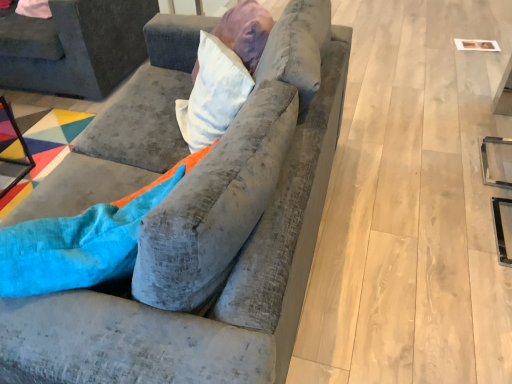
What do you see at coordinates (75, 46) in the screenshot? I see `velvet gray couch at upper left, marked as the second studio couch in a front-to-back arrangement` at bounding box center [75, 46].

At what (x,y) coordinates should I click in order to perform the action: click on velvet gray couch at upper left, marked as the second studio couch in a front-to-back arrangement. Please return your answer as a coordinate pair (x, y). The height and width of the screenshot is (384, 512). Looking at the image, I should click on (75, 46).

How much space does velvet gray couch at center, placed as the second studio couch when sorted from left to right, occupy vertically?

The height of velvet gray couch at center, placed as the second studio couch when sorted from left to right, is 34.11 inches.

The height and width of the screenshot is (384, 512). Find the location of `velvet gray couch at center, acting as the 1th studio couch starting from the front`. velvet gray couch at center, acting as the 1th studio couch starting from the front is located at coordinates (214, 250).

The height and width of the screenshot is (384, 512). What do you see at coordinates (214, 250) in the screenshot?
I see `velvet gray couch at center, acting as the 1th studio couch starting from the front` at bounding box center [214, 250].

Locate an element on the screen. The image size is (512, 384). velvet gray couch at upper left, the 1th studio couch from the back is located at coordinates (75, 46).

Is velvet gray couch at center, the 2th studio couch positioned from the back, to the right of velvet gray couch at upper left, marked as the second studio couch in a front-to-back arrangement, from the viewer's perspective?

Yes.

Is velvet gray couch at center, acting as the 1th studio couch starting from the front, positioned before velvet gray couch at upper left, marked as the second studio couch in a front-to-back arrangement?

That is True.

Which point is more distant from viewer, [309,195] or [83,19]?

The point [83,19] is more distant.

From the image's perspective, is velvet gray couch at center, placed as the second studio couch when sorted from left to right, positioned above or below velvet gray couch at upper left, the 1th studio couch from the back?

Clearly, from the image's perspective, velvet gray couch at center, placed as the second studio couch when sorted from left to right, is below velvet gray couch at upper left, the 1th studio couch from the back.

From a real-world perspective, which is physically above, velvet gray couch at center, the 2th studio couch positioned from the back, or velvet gray couch at upper left, marked as the second studio couch in a front-to-back arrangement?

velvet gray couch at center, the 2th studio couch positioned from the back.

Does velvet gray couch at center, the 2th studio couch positioned from the back, have a greater width compared to velvet gray couch at upper left, which ranks as the first studio couch in left-to-right order?

No, velvet gray couch at center, the 2th studio couch positioned from the back, is not wider than velvet gray couch at upper left, which ranks as the first studio couch in left-to-right order.

Is velvet gray couch at center, acting as the 1th studio couch starting from the front, taller than velvet gray couch at upper left, the 1th studio couch from the back?

Yes.

Is velvet gray couch at center, acting as the 1th studio couch starting from the front, smaller than velvet gray couch at upper left, marked as the second studio couch in a front-to-back arrangement?

No.

Is velvet gray couch at center, placed as the second studio couch when sorted from left to right, positioned beyond the bounds of velvet gray couch at upper left, marked as the 2th studio couch in a right-to-left arrangement?

velvet gray couch at center, placed as the second studio couch when sorted from left to right, lies outside velvet gray couch at upper left, marked as the 2th studio couch in a right-to-left arrangement,'s area.

Is there a large distance between velvet gray couch at center, which is counted as the first studio couch, starting from the right, and velvet gray couch at upper left, marked as the second studio couch in a front-to-back arrangement?

Indeed, velvet gray couch at center, which is counted as the first studio couch, starting from the right, is not near velvet gray couch at upper left, marked as the second studio couch in a front-to-back arrangement.

Is velvet gray couch at center, placed as the second studio couch when sorted from left to right, oriented towards velvet gray couch at upper left, marked as the 2th studio couch in a right-to-left arrangement?

Yes.

How distant is velvet gray couch at center, acting as the 1th studio couch starting from the front, from velvet gray couch at upper left, which ranks as the first studio couch in left-to-right order?

velvet gray couch at center, acting as the 1th studio couch starting from the front, and velvet gray couch at upper left, which ranks as the first studio couch in left-to-right order, are 1.79 meters apart from each other.

Image resolution: width=512 pixels, height=384 pixels. I want to click on studio couch above the velvet gray couch at center, which is counted as the first studio couch, starting from the right (from the image's perspective), so click(x=75, y=46).

Considering the positions of objects velvet gray couch at upper left, marked as the 2th studio couch in a right-to-left arrangement, and velvet gray couch at center, placed as the second studio couch when sorted from left to right, in the image provided, who is more to the left, velvet gray couch at upper left, marked as the 2th studio couch in a right-to-left arrangement, or velvet gray couch at center, placed as the second studio couch when sorted from left to right,?

From the viewer's perspective, velvet gray couch at upper left, marked as the 2th studio couch in a right-to-left arrangement, appears more on the left side.

Considering the relative positions of velvet gray couch at upper left, marked as the second studio couch in a front-to-back arrangement, and velvet gray couch at center, the 2th studio couch positioned from the back, in the image provided, is velvet gray couch at upper left, marked as the second studio couch in a front-to-back arrangement, in front of velvet gray couch at center, the 2th studio couch positioned from the back,?

That is False.

Is point (4, 61) closer or farther from the camera than point (142, 381)?

Point (4, 61) is farther from the camera than point (142, 381).

From the image's perspective, which is above, velvet gray couch at upper left, which ranks as the first studio couch in left-to-right order, or velvet gray couch at center, placed as the second studio couch when sorted from left to right?

velvet gray couch at upper left, which ranks as the first studio couch in left-to-right order, is shown above in the image.

From a real-world perspective, is velvet gray couch at upper left, marked as the 2th studio couch in a right-to-left arrangement, on top of velvet gray couch at center, acting as the 1th studio couch starting from the front?

Actually, velvet gray couch at upper left, marked as the 2th studio couch in a right-to-left arrangement, is physically below velvet gray couch at center, acting as the 1th studio couch starting from the front, in the real world.

Which of these two, velvet gray couch at upper left, which ranks as the first studio couch in left-to-right order, or velvet gray couch at center, the 2th studio couch positioned from the back, is wider?

With larger width is velvet gray couch at upper left, which ranks as the first studio couch in left-to-right order.

Is velvet gray couch at upper left, which ranks as the first studio couch in left-to-right order, taller or shorter than velvet gray couch at center, placed as the second studio couch when sorted from left to right?

Clearly, velvet gray couch at upper left, which ranks as the first studio couch in left-to-right order, is shorter compared to velvet gray couch at center, placed as the second studio couch when sorted from left to right.

Based on their sizes in the image, would you say velvet gray couch at upper left, the 1th studio couch from the back, is bigger or smaller than velvet gray couch at center, the 2th studio couch positioned from the back?

Considering their sizes, velvet gray couch at upper left, the 1th studio couch from the back, takes up less space than velvet gray couch at center, the 2th studio couch positioned from the back.

Is velvet gray couch at upper left, which ranks as the first studio couch in left-to-right order, situated inside velvet gray couch at center, acting as the 1th studio couch starting from the front, or outside?

velvet gray couch at upper left, which ranks as the first studio couch in left-to-right order, is not inside velvet gray couch at center, acting as the 1th studio couch starting from the front, it's outside.

Is there a large distance between velvet gray couch at upper left, marked as the second studio couch in a front-to-back arrangement, and velvet gray couch at center, the 2th studio couch positioned from the back?

Yes, velvet gray couch at upper left, marked as the second studio couch in a front-to-back arrangement, and velvet gray couch at center, the 2th studio couch positioned from the back, are quite far apart.

Consider the image. Is velvet gray couch at upper left, which ranks as the first studio couch in left-to-right order, aimed at velvet gray couch at center, placed as the second studio couch when sorted from left to right?

No.

Locate an element on the screen. studio couch below the velvet gray couch at upper left, the 1th studio couch from the back (from the image's perspective) is located at coordinates (214, 250).

At what (x,y) coordinates should I click in order to perform the action: click on studio couch that appears below the velvet gray couch at center, acting as the 1th studio couch starting from the front (from a real-world perspective). Please return your answer as a coordinate pair (x, y). Looking at the image, I should click on (75, 46).

In order to click on studio couch located on the left of velvet gray couch at center, the 2th studio couch positioned from the back in this screenshot , I will do `click(75, 46)`.